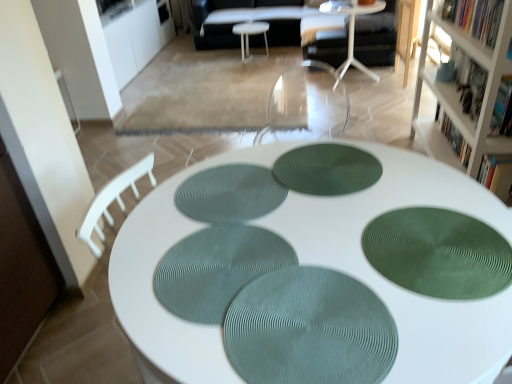
Locate an element on the screen. free space in front of green textured mat at lower right, acting as the fourth mat starting from the left is located at coordinates 434,338.